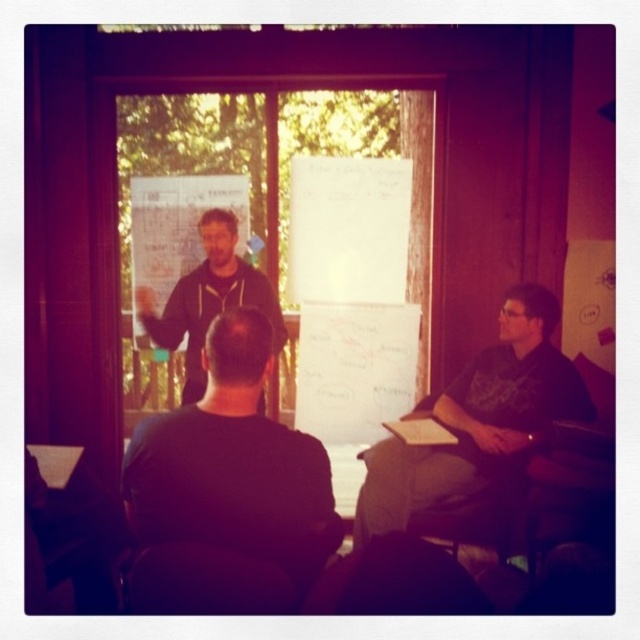
Who is taller, matte black hoodie at center or white matte board at center?

matte black hoodie at center

Where is `matte black hoodie at center`? matte black hoodie at center is located at coordinates (209, 300).

Which is in front, point (227, 221) or point (243, 216)?

Positioned in front is point (227, 221).

Find the location of a particular element. The width and height of the screenshot is (640, 640). matte black hoodie at center is located at coordinates (209, 300).

Between black matte shirt at center and matte black hoodie at center, which one has less height?

With less height is black matte shirt at center.

Is black matte shirt at center shorter than matte black hoodie at center?

Correct, black matte shirt at center is not as tall as matte black hoodie at center.

The width and height of the screenshot is (640, 640). Identify the location of black matte shirt at center. (234, 467).

Who is lower down, dark gray shirt at right or matte black hoodie at center?

dark gray shirt at right is below.

Is point (452, 412) positioned before point (184, 308)?

Yes, point (452, 412) is in front of point (184, 308).

Locate an element on the screen. dark gray shirt at right is located at coordinates (477, 433).